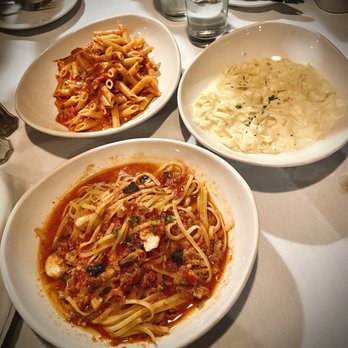
Where is `water glasses`? water glasses is located at coordinates (201, 26), (170, 6), (327, 6).